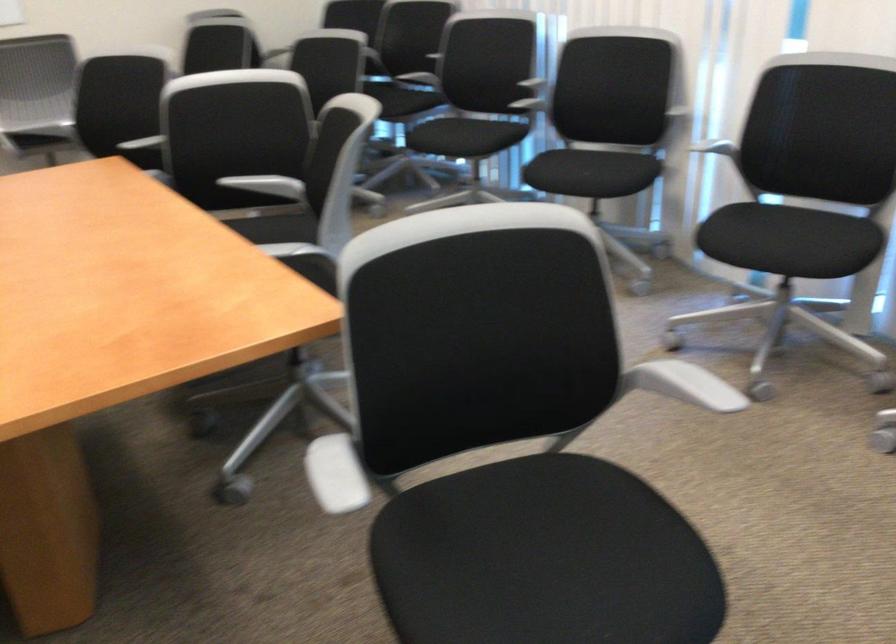
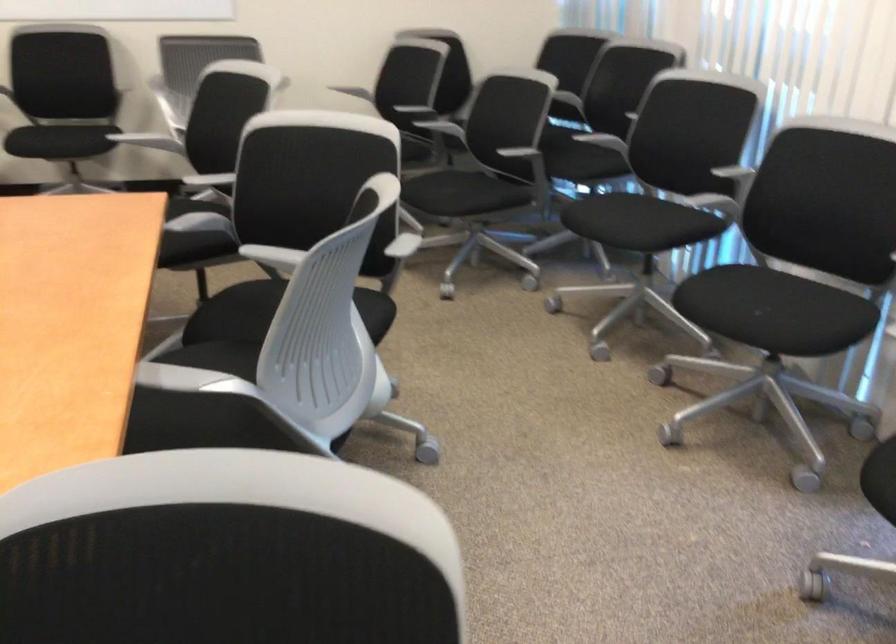
Where in the second image is the point corresponding to the point at 596,171 from the first image?

(771, 310)